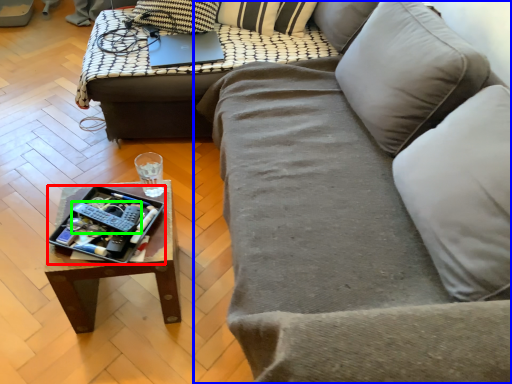
Question: Considering the real-world distances, which object is farthest from tray (highlighted by a red box)? studio couch (highlighted by a blue box) or remote (highlighted by a green box)?

Choices:
 (A) studio couch
 (B) remote

Answer: (A)